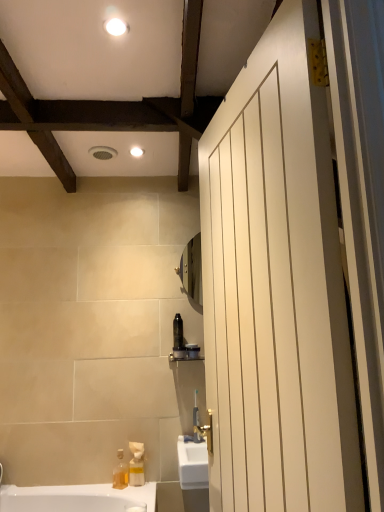
What is the approximate height of translucent plastic soap dispenser at lower left?

translucent plastic soap dispenser at lower left is 17.90 centimeters in height.

Find the location of a particular element. This screenshot has height=512, width=384. translucent plastic soap dispenser at lower left is located at coordinates (120, 472).

This screenshot has height=512, width=384. Describe the element at coordinates (137, 151) in the screenshot. I see `white glossy light fixture at upper center, positioned as the second light fixture in front-to-back order` at that location.

Find the location of `white glossy light fixture at upper center, which is the first light fixture from top to bottom`. white glossy light fixture at upper center, which is the first light fixture from top to bottom is located at coordinates (116, 26).

Where is `white matte door at right`? This screenshot has height=512, width=384. white matte door at right is located at coordinates (276, 289).

Where is `translucent plastic soap dispenser at lower left`? Image resolution: width=384 pixels, height=512 pixels. translucent plastic soap dispenser at lower left is located at coordinates (120, 472).

Is white matte door at right inside the boundaries of matte black toothbrush at center, or outside?

white matte door at right is outside matte black toothbrush at center.

Consider the image. Is white matte door at right positioned before matte black toothbrush at center?

Yes.

Can you confirm if white matte door at right is positioned to the left of matte black toothbrush at center?

No, white matte door at right is not to the left of matte black toothbrush at center.

Which is behind, point (283, 301) or point (194, 353)?

The point (194, 353) is farther from the camera.

Is translucent plastic soap dispenser at lower left inside matte black toothbrush at center?

Actually, translucent plastic soap dispenser at lower left is outside matte black toothbrush at center.

From the image's perspective, is matte black toothbrush at center located above or below translucent plastic soap dispenser at lower left?

matte black toothbrush at center is situated higher than translucent plastic soap dispenser at lower left in the image.

Considering the positions of point (190, 349) and point (120, 461), is point (190, 349) closer or farther from the camera than point (120, 461)?

Point (190, 349) is farther from the camera than point (120, 461).

Where is `soap dispenser in front of the white glossy light fixture at upper center, which is the 1th light fixture in bottom-to-top order`? soap dispenser in front of the white glossy light fixture at upper center, which is the 1th light fixture in bottom-to-top order is located at coordinates (120, 472).

Is translucent plastic soap dispenser at lower left surrounding white glossy light fixture at upper center, the first light fixture positioned from the back?

That's incorrect, white glossy light fixture at upper center, the first light fixture positioned from the back, is not inside translucent plastic soap dispenser at lower left.

From the image's perspective, is translucent plastic soap dispenser at lower left located above or below white glossy light fixture at upper center, which is the 1th light fixture in bottom-to-top order?

Clearly, from the image's perspective, translucent plastic soap dispenser at lower left is below white glossy light fixture at upper center, which is the 1th light fixture in bottom-to-top order.

Is white matte door at right at the back of white glossy light fixture at upper center, the second light fixture positioned from the back?

white glossy light fixture at upper center, the second light fixture positioned from the back, does not have its back to white matte door at right.

Is white glossy light fixture at upper center, which is the first light fixture from top to bottom, far away from white matte door at right?

That's not correct — white glossy light fixture at upper center, which is the first light fixture from top to bottom, is a little close to white matte door at right.

Between white glossy light fixture at upper center, marked as the first light fixture in a front-to-back arrangement, and white matte door at right, which one has larger width?

With larger width is white matte door at right.

From a real-world perspective, does white matte door at right sit lower than white glossy light fixture at upper center, positioned as the second light fixture in front-to-back order?

Yes.

Which is in front, point (242, 239) or point (138, 148)?

The point (242, 239) is in front.

In terms of width, does white matte door at right look wider or thinner when compared to white glossy light fixture at upper center, which is the 1th light fixture in bottom-to-top order?

Considering their sizes, white matte door at right looks broader than white glossy light fixture at upper center, which is the 1th light fixture in bottom-to-top order.

Who is bigger, white matte door at right or white glossy light fixture at upper center, the 2th light fixture viewed from the top?

Bigger between the two is white matte door at right.

Does point (329, 146) come closer to viewer compared to point (120, 23)?

Yes, point (329, 146) is closer to viewer.

Choose the correct answer: Is white matte door at right inside white glossy light fixture at upper center, placed as the second light fixture when sorted from bottom to top, or outside it?

white matte door at right is not inside white glossy light fixture at upper center, placed as the second light fixture when sorted from bottom to top, it's outside.

Can you confirm if white matte door at right is wider than white glossy light fixture at upper center, placed as the second light fixture when sorted from bottom to top?

Correct, the width of white matte door at right exceeds that of white glossy light fixture at upper center, placed as the second light fixture when sorted from bottom to top.

Considering the sizes of white matte door at right and white glossy light fixture at upper center, the second light fixture positioned from the back, in the image, is white matte door at right bigger or smaller than white glossy light fixture at upper center, the second light fixture positioned from the back,?

Clearly, white matte door at right is larger in size than white glossy light fixture at upper center, the second light fixture positioned from the back.

Is matte black toothbrush at center aimed at white glossy light fixture at upper center, marked as the first light fixture in a front-to-back arrangement?

No, matte black toothbrush at center is not oriented towards white glossy light fixture at upper center, marked as the first light fixture in a front-to-back arrangement.

Is matte black toothbrush at center shorter than white glossy light fixture at upper center, placed as the second light fixture when sorted from bottom to top?

No.

Which is in front, matte black toothbrush at center or white glossy light fixture at upper center, placed as the second light fixture when sorted from bottom to top?

white glossy light fixture at upper center, placed as the second light fixture when sorted from bottom to top.

Does matte black toothbrush at center have a lesser width compared to white glossy light fixture at upper center, which is the first light fixture from top to bottom?

Yes, matte black toothbrush at center is thinner than white glossy light fixture at upper center, which is the first light fixture from top to bottom.

In order to click on door that appears above the matte black toothbrush at center (from the image's perspective) in this screenshot , I will do `click(276, 289)`.

I want to click on soap dispenser that is below the matte black toothbrush at center (from the image's perspective), so click(x=120, y=472).

Looking at the image, which one is located further to white matte door at right, translucent plastic soap dispenser at lower left or white glossy light fixture at upper center, the first light fixture positioned from the back?

translucent plastic soap dispenser at lower left is further to white matte door at right.

When comparing their distances from matte black toothbrush at center, does translucent plastic soap dispenser at lower left or white matte door at right seem further?

Based on the image, white matte door at right appears to be further to matte black toothbrush at center.

Estimate the real-world distances between objects in this image. Which object is further from white glossy light fixture at upper center, placed as the second light fixture when sorted from bottom to top, matte black toothbrush at center or white matte door at right?

matte black toothbrush at center is further to white glossy light fixture at upper center, placed as the second light fixture when sorted from bottom to top.

From the image, which object appears to be nearer to matte black toothbrush at center, translucent plastic soap dispenser at lower left or white glossy light fixture at upper center, the second light fixture positioned from the back?

translucent plastic soap dispenser at lower left.

Considering their positions, is white matte door at right positioned closer to white glossy light fixture at upper center, which is the 1th light fixture in bottom-to-top order, than white glossy light fixture at upper center, marked as the first light fixture in a front-to-back arrangement?

white glossy light fixture at upper center, marked as the first light fixture in a front-to-back arrangement.

When comparing their distances from matte black toothbrush at center, does white glossy light fixture at upper center, the first light fixture positioned from the back, or white matte door at right seem closer?

white glossy light fixture at upper center, the first light fixture positioned from the back.

Considering their positions, is translucent plastic soap dispenser at lower left positioned closer to white matte door at right than white glossy light fixture at upper center, the second light fixture positioned from the back?

white glossy light fixture at upper center, the second light fixture positioned from the back, lies closer to white matte door at right than the other object.

Based on their spatial positions, is matte black toothbrush at center or white glossy light fixture at upper center, positioned as the second light fixture in front-to-back order, closer to white glossy light fixture at upper center, the second light fixture positioned from the back?

white glossy light fixture at upper center, positioned as the second light fixture in front-to-back order, lies closer to white glossy light fixture at upper center, the second light fixture positioned from the back, than the other object.

At what (x,y) coordinates should I click in order to perform the action: click on toiletry between white glossy light fixture at upper center, marked as the first light fixture in a front-to-back arrangement, and translucent plastic soap dispenser at lower left in the up-down direction. Please return your answer as a coordinate pair (x, y). This screenshot has height=512, width=384. Looking at the image, I should click on (192, 351).

Locate an element on the screen. soap dispenser between white matte door at right and white glossy light fixture at upper center, the 2th light fixture viewed from the top, from front to back is located at coordinates (120, 472).

Identify the location of soap dispenser between white matte door at right and matte black toothbrush at center in the front-back direction. (120, 472).

The height and width of the screenshot is (512, 384). I want to click on light fixture that lies between white glossy light fixture at upper center, which is the first light fixture from top to bottom, and matte black toothbrush at center from top to bottom, so click(137, 151).